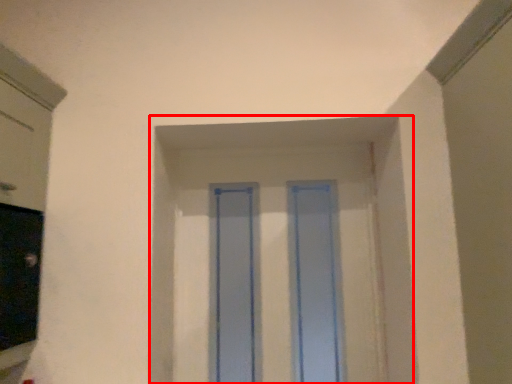
Question: From the image's perspective, what is the correct spatial positioning of window frame (annotated by the red box) in reference to glass door?

Choices:
 (A) above
 (B) below

Answer: (B)